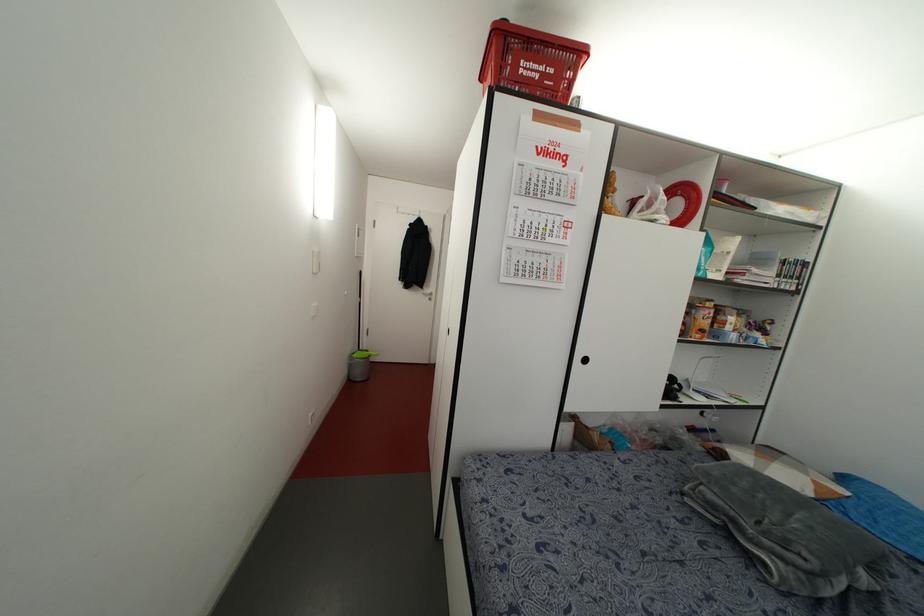
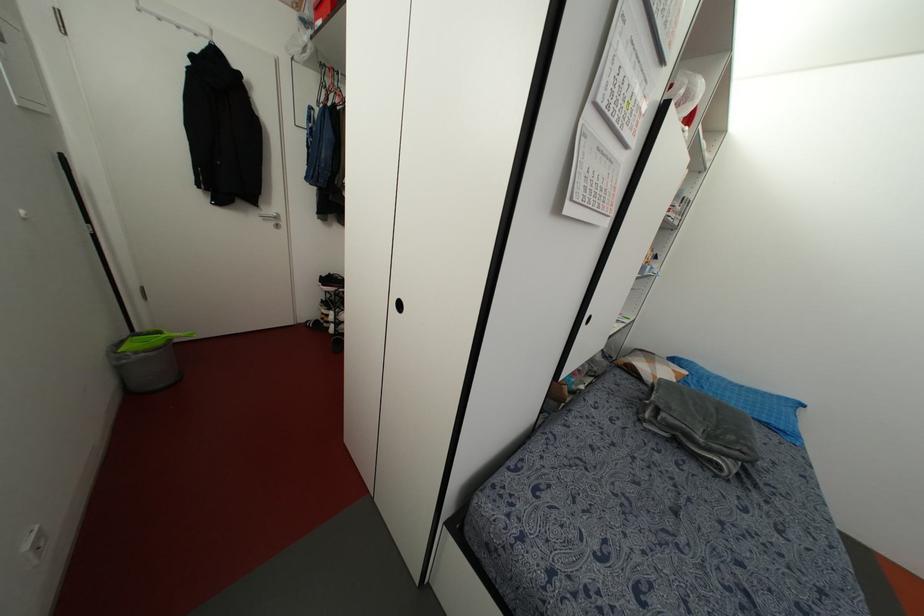
In the second image, find the point that corresponds to point 369,355 in the first image.

(168, 339)